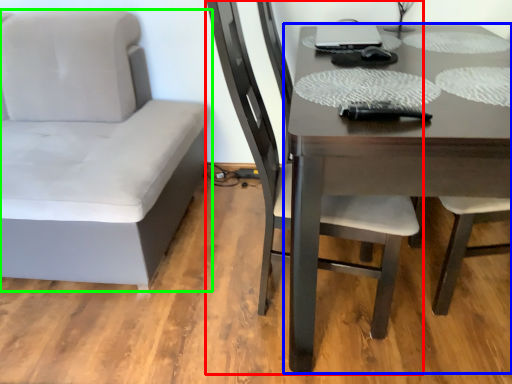
Question: Which object is positioned closest to chair (highlighted by a red box)? Select from table (highlighted by a blue box) and chair (highlighted by a green box).

Choices:
 (A) table
 (B) chair

Answer: (A)